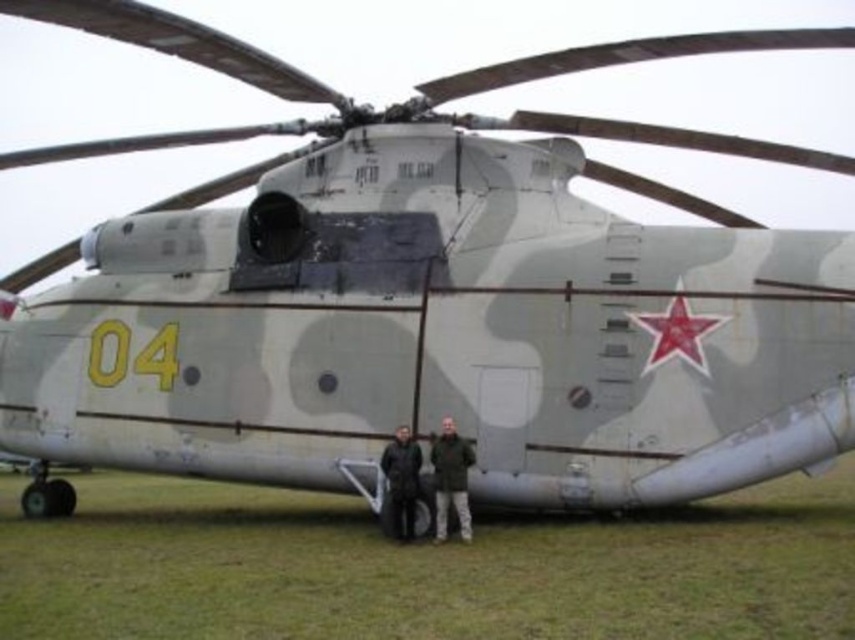
Question: Is green grass at lower center above dark green fabric jacket at center?

Choices:
 (A) no
 (B) yes

Answer: (A)

Question: Which of the following is the closest to the observer?

Choices:
 (A) (447, 449)
 (B) (202, 524)
 (C) (408, 513)

Answer: (A)

Question: Among these points, which one is farthest from the camera?

Choices:
 (A) (463, 484)
 (B) (81, 563)
 (C) (414, 468)

Answer: (C)

Question: Among these objects, which one is farthest from the camera?

Choices:
 (A) dark green fabric jacket at center
 (B) green grass at lower center
 (C) black matte jacket at center

Answer: (C)

Question: Observing the image, what is the correct spatial positioning of green grass at lower center in reference to black matte jacket at center?

Choices:
 (A) below
 (B) above

Answer: (A)

Question: Considering the relative positions of green grass at lower center and dark green fabric jacket at center in the image provided, where is green grass at lower center located with respect to dark green fabric jacket at center?

Choices:
 (A) left
 (B) right

Answer: (A)